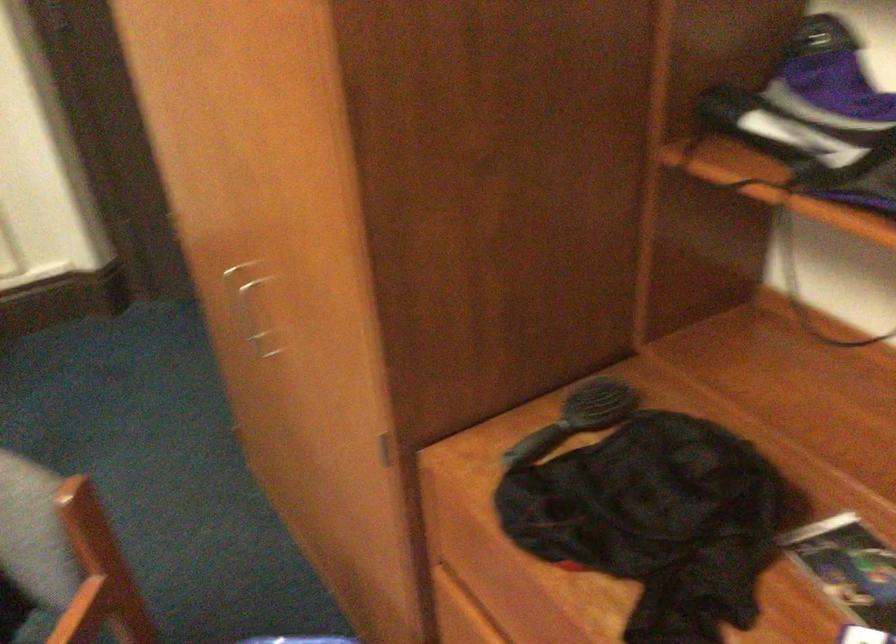
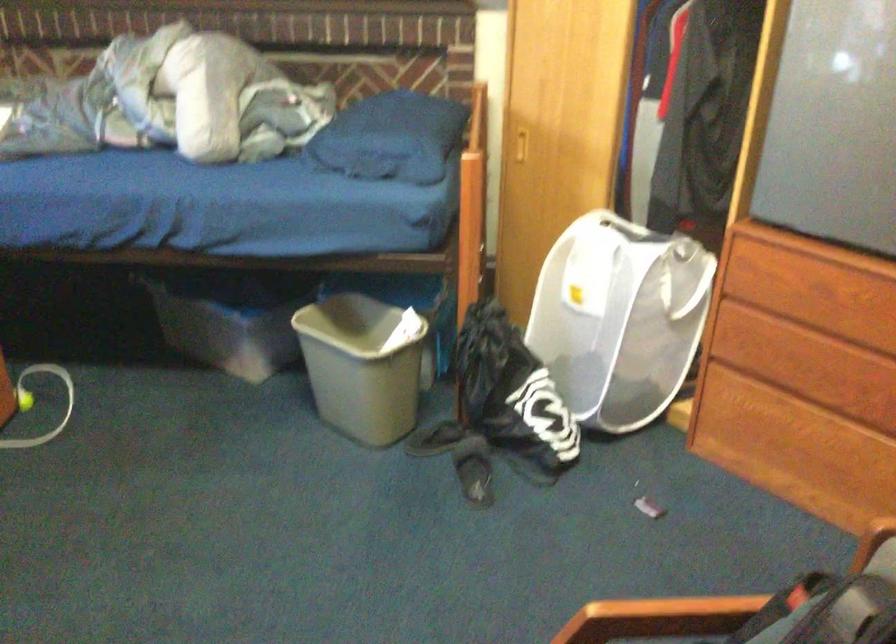
How did the camera likely rotate?

The camera rotated toward left-down.